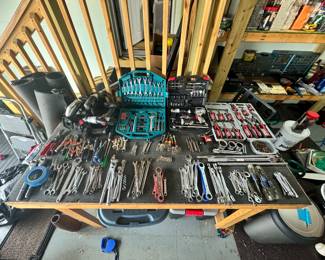
Locate an element on the screen. The image size is (325, 260). doormat is located at coordinates coord(123,69).